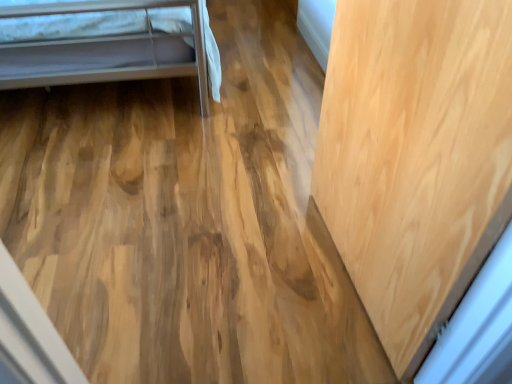
This screenshot has height=384, width=512. Identify the location of light wood door at right. (415, 157).

Describe the element at coordinates (415, 157) in the screenshot. I see `light wood door at right` at that location.

Locate an element on the screen. The image size is (512, 384). light wood door at right is located at coordinates (415, 157).